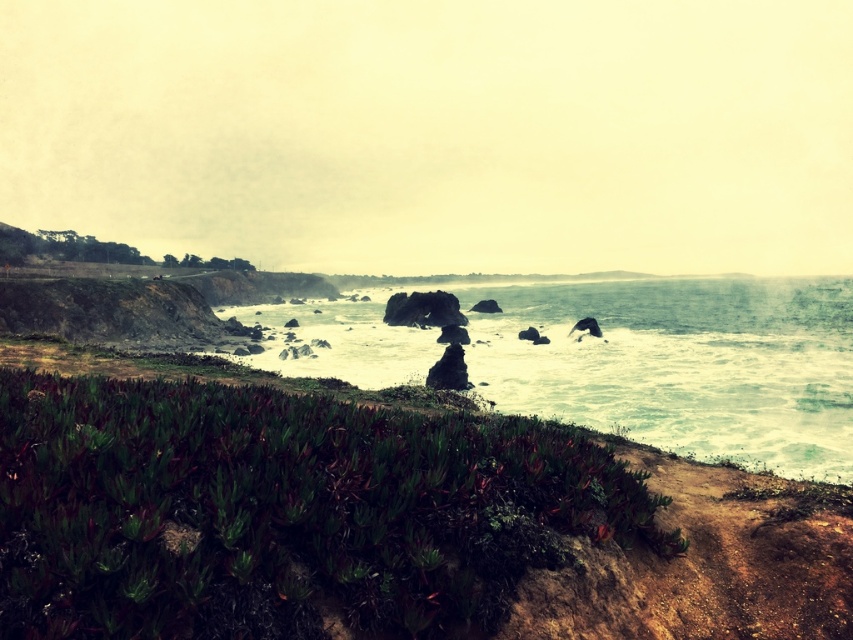
Question: Does green succulent at center come behind white frothy water at center?

Choices:
 (A) yes
 (B) no

Answer: (B)

Question: Is green succulent at center thinner than white frothy water at center?

Choices:
 (A) no
 (B) yes

Answer: (B)

Question: Which point appears closest to the camera in this image?

Choices:
 (A) (735, 460)
 (B) (544, 429)

Answer: (B)

Question: Which object appears closest to the camera in this image?

Choices:
 (A) white frothy water at center
 (B) green succulent at center

Answer: (B)

Question: Observing the image, what is the correct spatial positioning of green succulent at center in reference to white frothy water at center?

Choices:
 (A) right
 (B) left

Answer: (B)